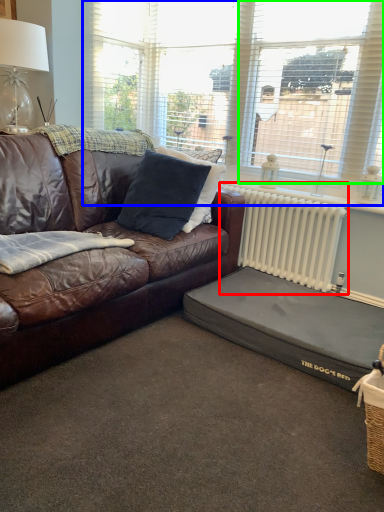
Question: Which is nearer to the radiator (highlighted by a red box)? window (highlighted by a blue box) or window (highlighted by a green box).

Choices:
 (A) window
 (B) window

Answer: (B)